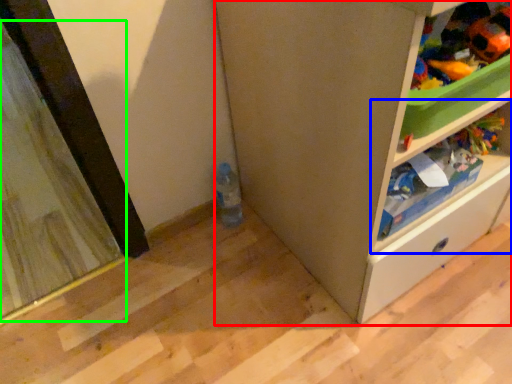
Question: Estimate the real-world distances between objects in this image. Which object is closer to cabinetry (highlighted by a red box), shelf (highlighted by a blue box) or screen door (highlighted by a green box)?

Choices:
 (A) shelf
 (B) screen door

Answer: (A)